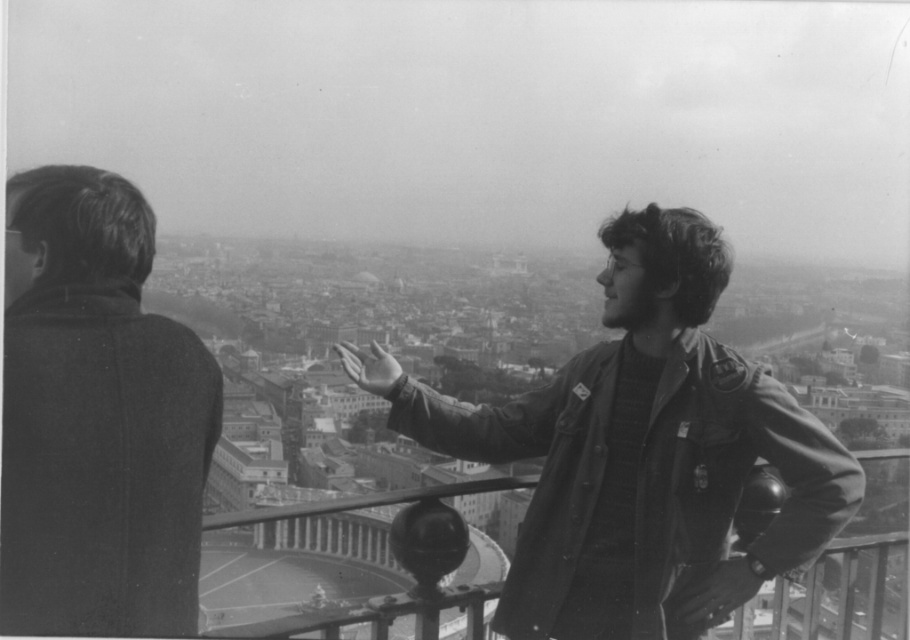
Between leather jacket at center and coarse wool coat at left, which one appears on the left side from the viewer's perspective?

Positioned to the left is coarse wool coat at left.

Locate an element on the screen. Image resolution: width=910 pixels, height=640 pixels. leather jacket at center is located at coordinates (640, 452).

Where is `leather jacket at center`? The width and height of the screenshot is (910, 640). leather jacket at center is located at coordinates (640, 452).